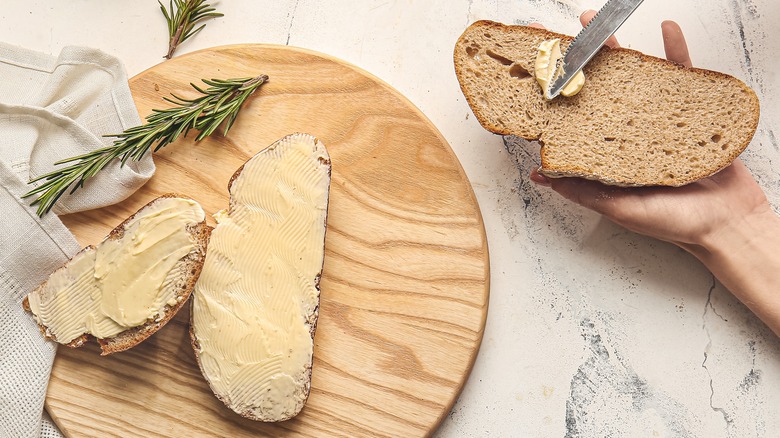
Identify the location of wooden tray. This screenshot has width=780, height=438. (399, 246).